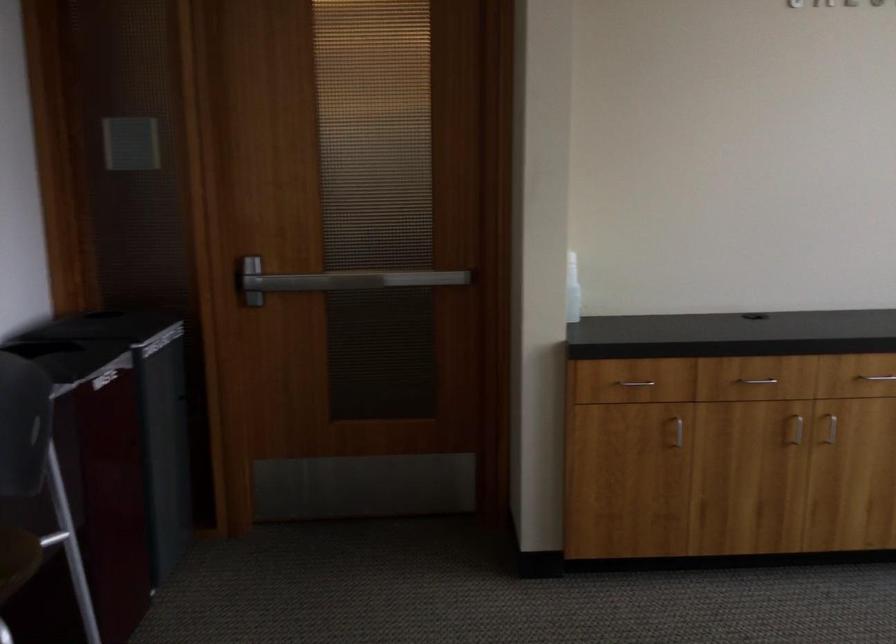
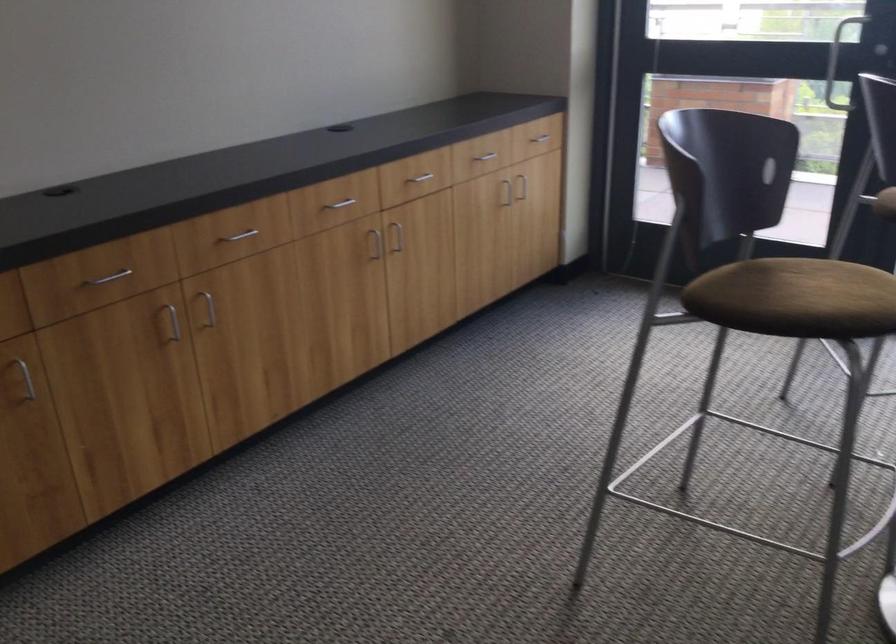
Based on the continuous images, in which direction is the camera rotating?

The camera rotated toward right-down.